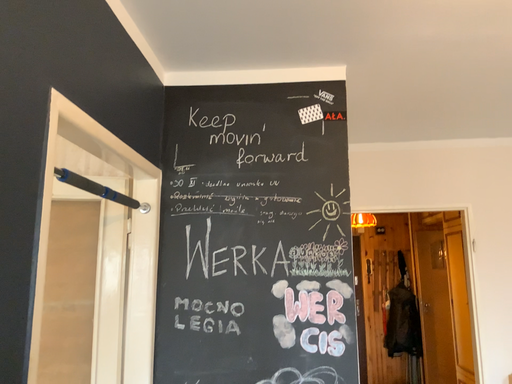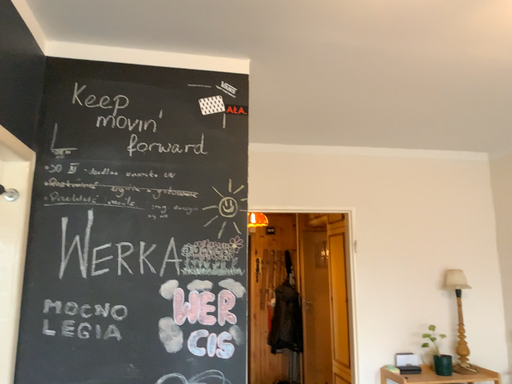
Question: How did the camera likely rotate when shooting the video?

Choices:
 (A) rotated left
 (B) rotated right

Answer: (B)